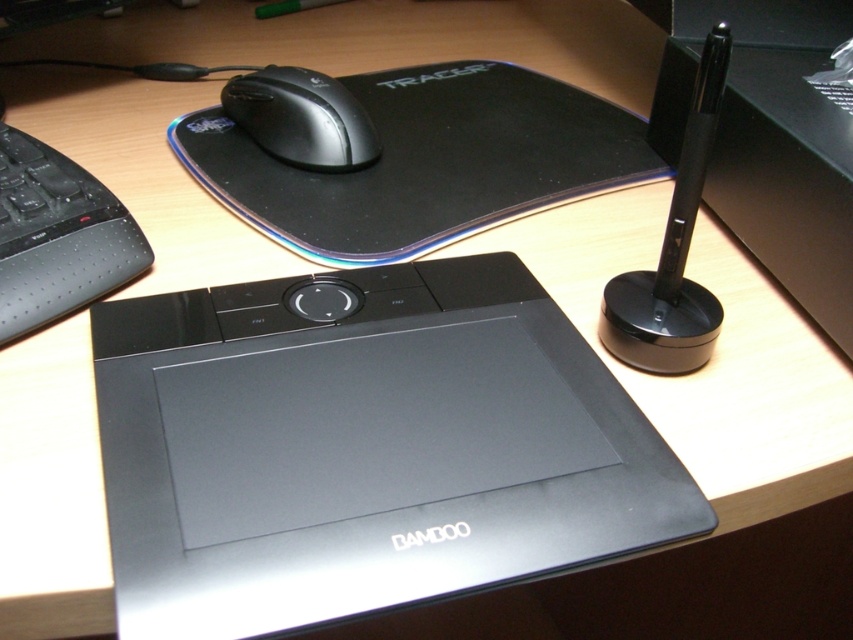
Who is taller, matte black tablet at center or matte black mouse at upper center?

matte black tablet at center

Is matte black tablet at center in front of matte black mouse at upper center?

Yes, it is in front of matte black mouse at upper center.

Which is in front, point (537, 547) or point (309, 93)?

Point (537, 547)

This screenshot has width=853, height=640. Identify the location of matte black tablet at center. (363, 449).

Is matte black tablet at center positioned before black rubber mousepad at upper center?

Yes.

Locate an element on the screen. The width and height of the screenshot is (853, 640). matte black tablet at center is located at coordinates point(363,449).

The image size is (853, 640). Find the location of `matte black tablet at center`. matte black tablet at center is located at coordinates (363, 449).

Between black rubber mousepad at upper center and matte black mouse at upper center, which one appears on the left side from the viewer's perspective?

Positioned to the left is matte black mouse at upper center.

Describe the element at coordinates (425, 161) in the screenshot. I see `black rubber mousepad at upper center` at that location.

You are a GUI agent. You are given a task and a screenshot of the screen. Output one action in this format:
    pyautogui.click(x=<x>, y=<y>)
    Task: Click on the black rubber mousepad at upper center
    Image resolution: width=853 pixels, height=640 pixels.
    Given the screenshot: What is the action you would take?
    pyautogui.click(x=425, y=161)